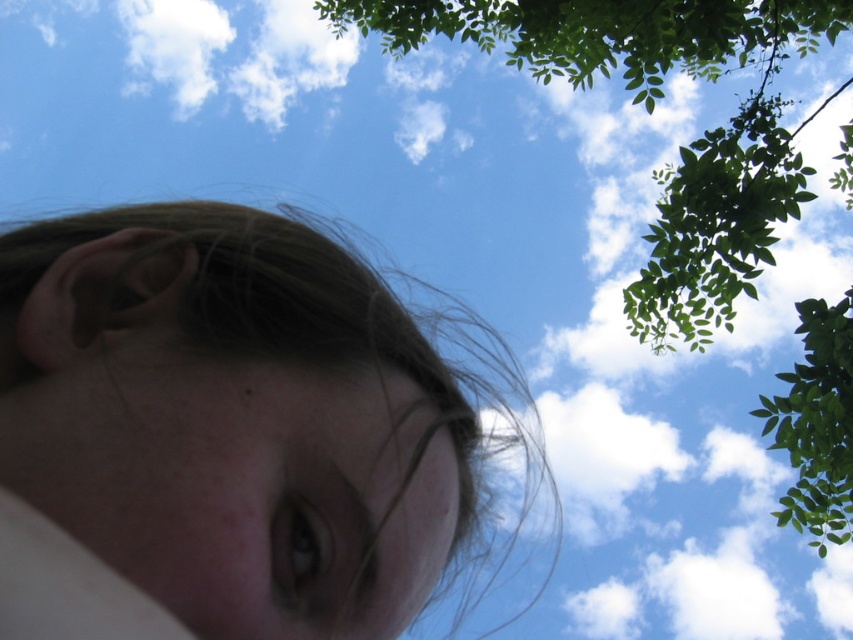
Question: Which of these objects is positioned farthest from the smooth skin face at center?

Choices:
 (A) green leafy tree at upper right
 (B) smooth skin eye at center

Answer: (A)

Question: Which object is positioned farthest from the smooth skin eye at center?

Choices:
 (A) smooth skin face at center
 (B) green leafy tree at upper right

Answer: (B)

Question: Is smooth skin face at center thinner than green leafy tree at upper right?

Choices:
 (A) yes
 (B) no

Answer: (A)

Question: Does smooth skin face at center have a lesser width compared to smooth skin eye at center?

Choices:
 (A) no
 (B) yes

Answer: (A)

Question: Among these objects, which one is farthest from the camera?

Choices:
 (A) smooth skin face at center
 (B) smooth skin eye at center

Answer: (A)

Question: Can you confirm if smooth skin face at center is positioned below green leafy tree at upper right?

Choices:
 (A) no
 (B) yes

Answer: (B)